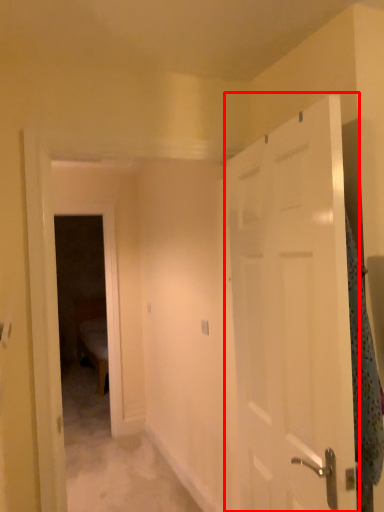
Question: Where is door (annotated by the red box) located in relation to blanket in the image?

Choices:
 (A) left
 (B) right

Answer: (A)